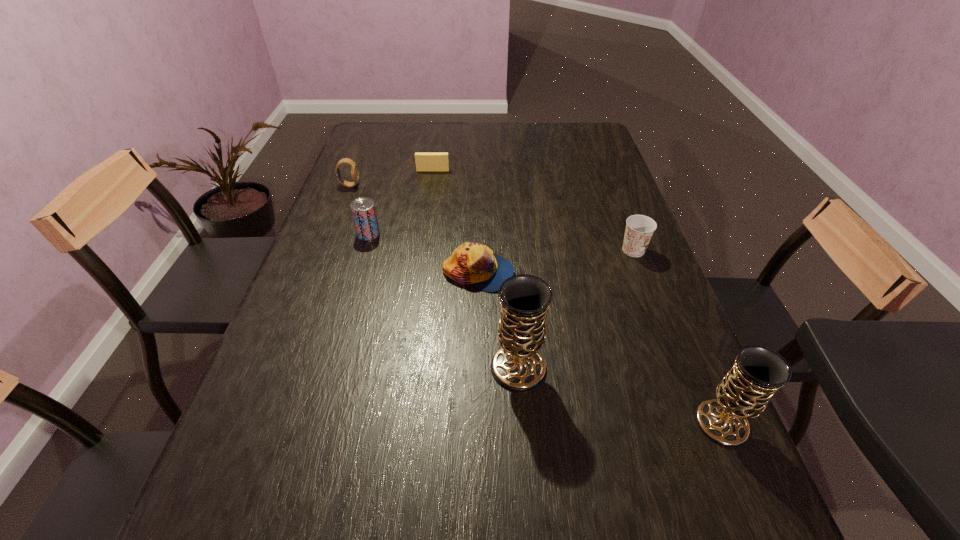
Identify the location of the left chalice. (525, 299).

Locate an element on the screen. the farther chalice is located at coordinates (525, 299).

You are a GUI agent. You are given a task and a screenshot of the screen. Output one action in this format:
    pyautogui.click(x=<x>, y=<y>)
    Task: Click on the second tallest object
    The width and height of the screenshot is (960, 540).
    Given the screenshot: What is the action you would take?
    pyautogui.click(x=758, y=372)

Image resolution: width=960 pixels, height=540 pixels. Identify the location of the shorter chalice. (758, 372).

This screenshot has width=960, height=540. Find the location of `the farthest object`. the farthest object is located at coordinates (424, 161).

Identify the location of the shortest object. (424, 161).

In order to click on the leftmost object in this screenshot , I will do `click(354, 168)`.

Identify the location of watch. (354, 168).

You are a GUI agent. You are given a task and a screenshot of the screen. Output one action in this format:
    pyautogui.click(x=<x>, y=<y>)
    Task: Click on the second object from left to right
    
    Given the screenshot: What is the action you would take?
    pyautogui.click(x=363, y=209)

I want to click on the third farthest object, so click(363, 209).